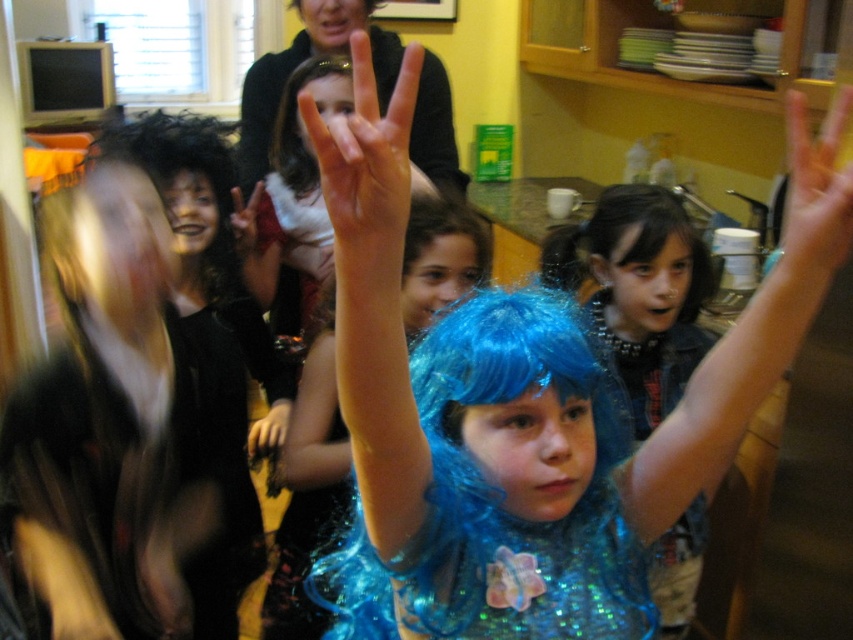
You are a photographer at the party and want to capture a closeup of the dark brown shiny hair at center and the smooth skin hand at upper right in the same frame. Which object should you focus on first to ensure it is in focus?

The dark brown shiny hair at center should be focused on first because it occupies less space than the smooth skin hand at upper right, so it might be farther away and require adjusting the focus accordingly.

You are a photographer at the party and want to capture a closeup of the dark brown shiny hair at center without moving the camera. Is it possible to do so with your current camera settings?

The dark brown shiny hair at center is 4.81 feet away from the camera. Since most cameras can focus on objects at this distance, it is possible to capture a closeup without moving the camera.

You are holding a 50 cm long ribbon and want to attach it to the point at coordinates point (392,120). Can you reach it without moving your position?

The distance between you and point (392,120) is 56.13 centimeters. Since the ribbon is only 50 cm long, it is too short to reach the point. You need a longer ribbon.